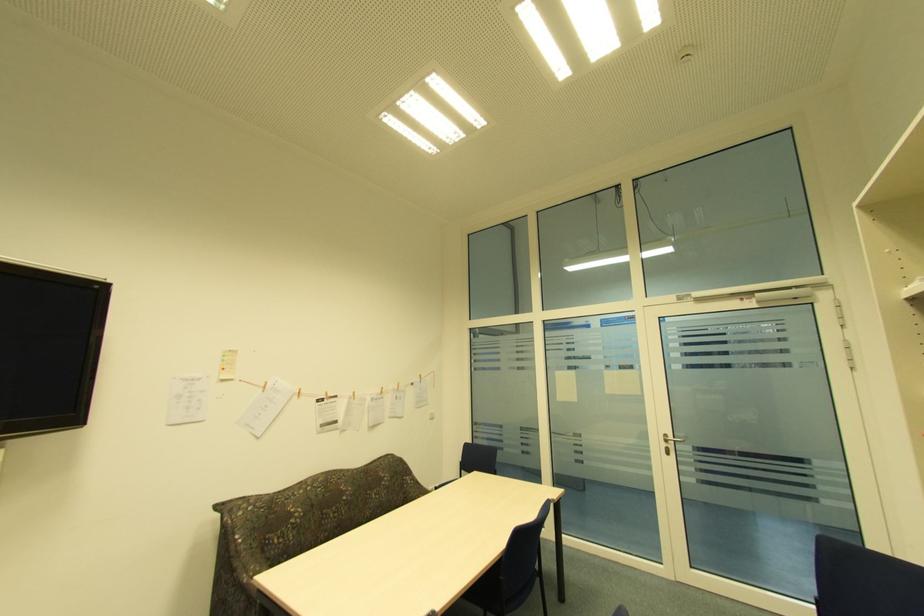
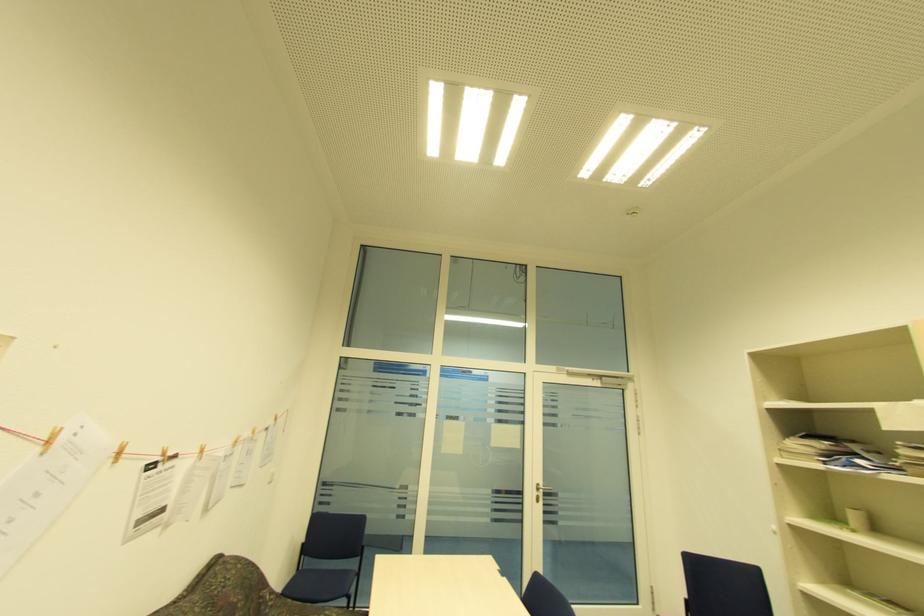
The point at (666, 445) is marked in the first image. Where is the corresponding point in the second image?

(538, 493)